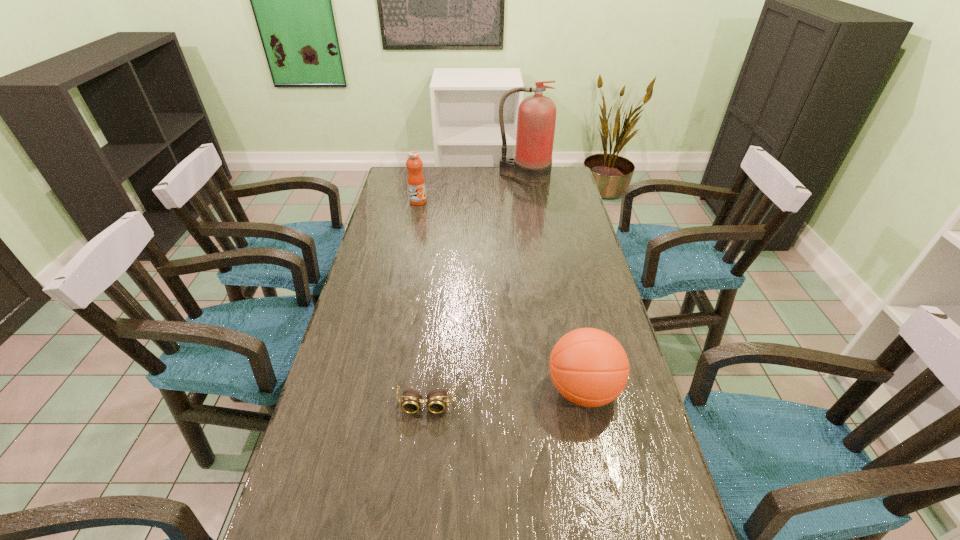
Locate an element on the screen. Image resolution: width=960 pixels, height=540 pixels. unoccupied position between the shortest object and the fire extinguisher is located at coordinates (474, 291).

Image resolution: width=960 pixels, height=540 pixels. In order to click on empty location between the tallest object and the shortest object in this screenshot , I will do `click(474, 291)`.

Image resolution: width=960 pixels, height=540 pixels. In order to click on free spot between the basketball and the shortest object in this screenshot , I will do `click(504, 397)`.

The image size is (960, 540). Identify the location of blank region between the shortest object and the basketball. (504, 397).

At what (x,y) coordinates should I click in order to perform the action: click on empty location between the goggles and the basketball. Please return your answer as a coordinate pair (x, y). Looking at the image, I should click on 504,397.

The image size is (960, 540). I want to click on free spot between the third nearest object and the basketball, so click(500, 296).

Find the location of a particular element. This screenshot has width=960, height=540. unoccupied position between the basketball and the farthest object is located at coordinates (553, 284).

The image size is (960, 540). In order to click on free spot between the shortest object and the basketball in this screenshot , I will do `click(504, 397)`.

Identify the location of object that can be found as the third closest to the basketball. The height and width of the screenshot is (540, 960). (531, 166).

Where is `object that ranks as the third closest to the third object from right to left`? object that ranks as the third closest to the third object from right to left is located at coordinates (531, 166).